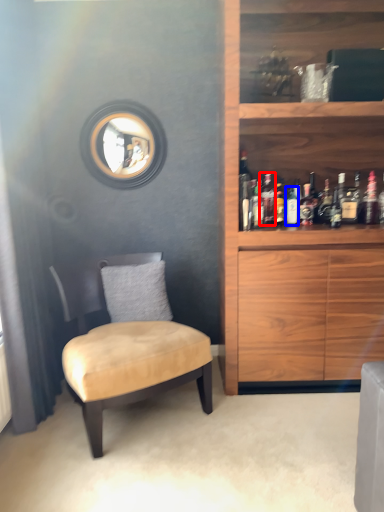
Question: Which of the following is the closest to the observer, bottle (highlighted by a red box) or bottle (highlighted by a blue box)?

Choices:
 (A) bottle
 (B) bottle

Answer: (A)